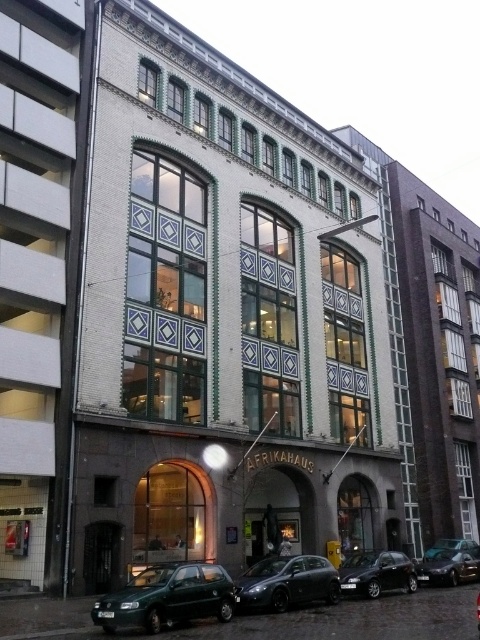
You are standing in front of the building and want to park your matte gray car at center near the entrance. Is the white brick building at left blocking the path to the entrance?

The white brick building at left is to the left of matte gray car at center, so it is not blocking the path to the entrance. You can park your matte gray car at center near the entrance without obstruction from the building.